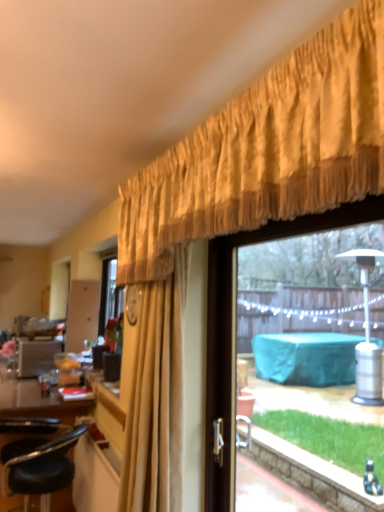
Question: Is black leather stool at lower left taller than transparent glass window at upper right?

Choices:
 (A) no
 (B) yes

Answer: (A)

Question: Considering the relative positions of black leather stool at lower left and transparent glass window at upper right in the image provided, is black leather stool at lower left behind transparent glass window at upper right?

Choices:
 (A) yes
 (B) no

Answer: (A)

Question: Does black leather stool at lower left have a smaller size compared to transparent glass window at upper right?

Choices:
 (A) yes
 (B) no

Answer: (B)

Question: Is transparent glass window at upper right located within black leather stool at lower left?

Choices:
 (A) yes
 (B) no

Answer: (B)

Question: From the image's perspective, would you say black leather stool at lower left is shown under transparent glass window at upper right?

Choices:
 (A) no
 (B) yes

Answer: (B)

Question: Considering the positions of point (150, 282) and point (41, 440), is point (150, 282) closer or farther from the camera than point (41, 440)?

Choices:
 (A) closer
 (B) farther

Answer: (A)

Question: Would you say gold textured curtain at upper center is to the left or to the right of black leather stool at lower left in the picture?

Choices:
 (A) left
 (B) right

Answer: (B)

Question: Considering the positions of gold textured curtain at upper center and black leather stool at lower left in the image, is gold textured curtain at upper center taller or shorter than black leather stool at lower left?

Choices:
 (A) short
 (B) tall

Answer: (B)

Question: From the image's perspective, is gold textured curtain at upper center above or below black leather stool at lower left?

Choices:
 (A) below
 (B) above

Answer: (B)

Question: Is black leather stool at lower left situated inside transparent glass window at upper right or outside?

Choices:
 (A) outside
 (B) inside

Answer: (A)

Question: From the image's perspective, is black leather stool at lower left above or below transparent glass window at upper right?

Choices:
 (A) above
 (B) below

Answer: (B)

Question: Is black leather stool at lower left taller or shorter than transparent glass window at upper right?

Choices:
 (A) short
 (B) tall

Answer: (A)

Question: From a real-world perspective, is black leather stool at lower left physically located above or below transparent glass window at upper right?

Choices:
 (A) above
 (B) below

Answer: (B)

Question: Relative to gold textured curtain at upper center, is black leather stool at lower left in front or behind?

Choices:
 (A) front
 (B) behind

Answer: (B)

Question: Based on their sizes in the image, would you say black leather stool at lower left is bigger or smaller than gold textured curtain at upper center?

Choices:
 (A) small
 (B) big

Answer: (B)